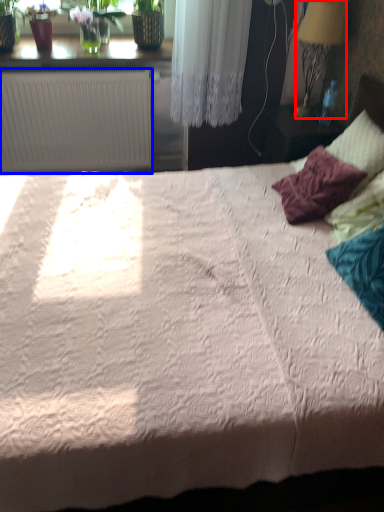
Question: Which object is closer to the camera taking this photo, lamp (highlighted by a red box) or radiator (highlighted by a blue box)?

Choices:
 (A) lamp
 (B) radiator

Answer: (A)